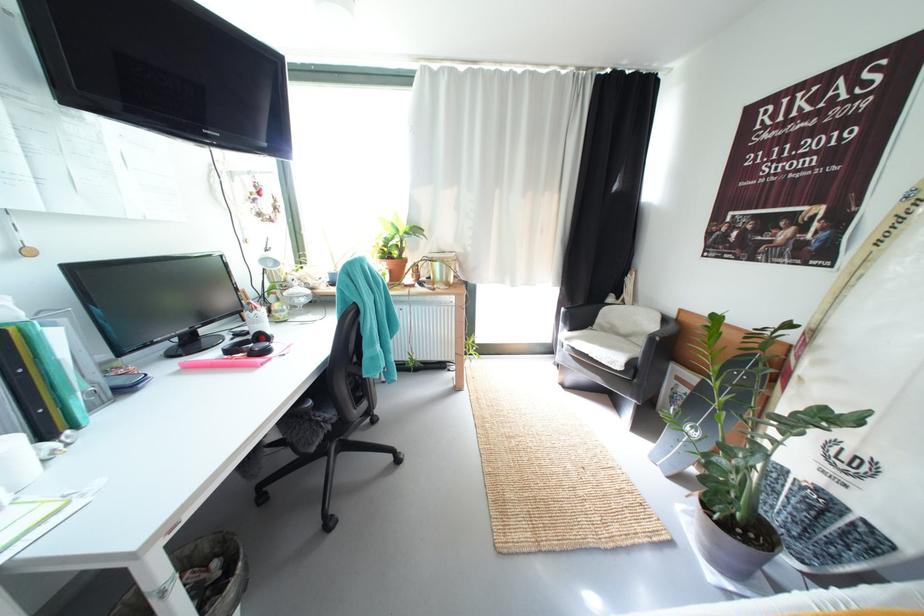
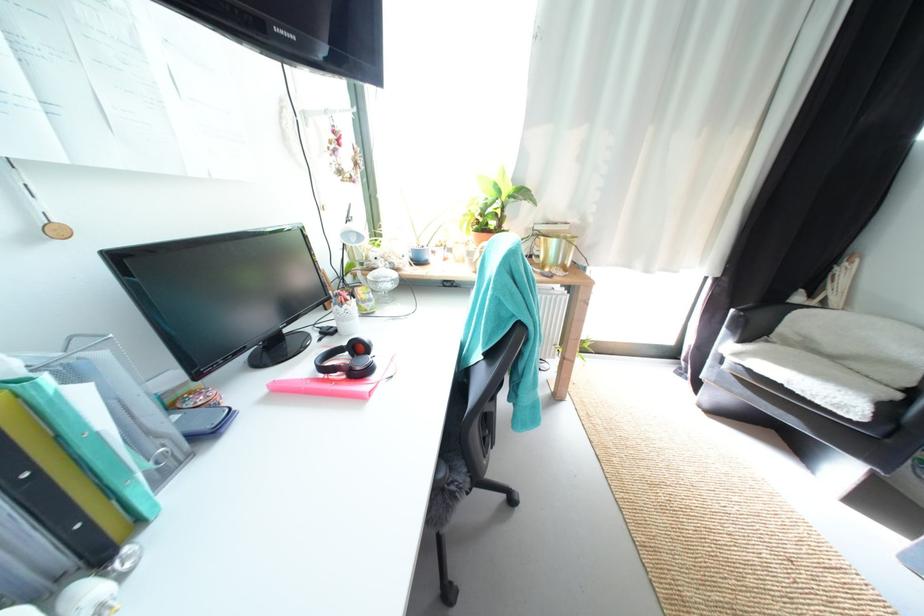
Locate, in the second image, the point that corresponds to (444,267) in the first image.

(562, 244)